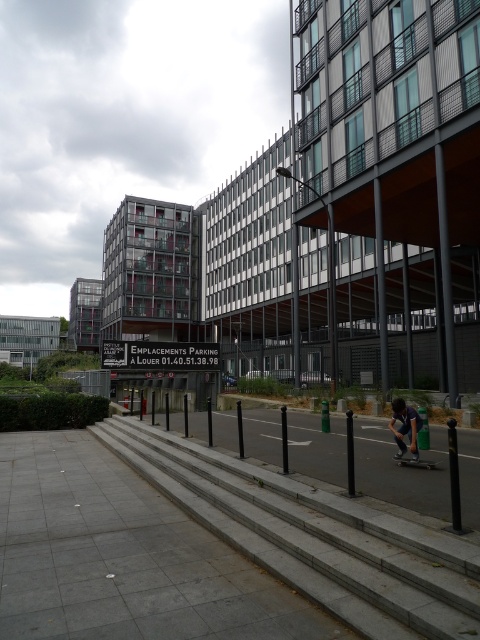
You are a delivery person who needs to deliver a package to the address located at the parking entrance. You are currently standing at the gray concrete stairs at center. Which direction should you move to reach the black smooth skateboard at lower right to continue your delivery route?

Since the gray concrete stairs at center is positioned on the left side of the black smooth skateboard at lower right, you should move to the right to reach the skateboard and continue your delivery route.

You are standing at the parking entrance and want to take a photo of both point (x=176, y=499) and point (x=414, y=442) in the background. Which point should you focus on first to ensure both are in focus?

You should focus on point (x=176, y=499) first because it is closer to you than point (x=414, y=442), ensuring both will be in focus when using depth of field.